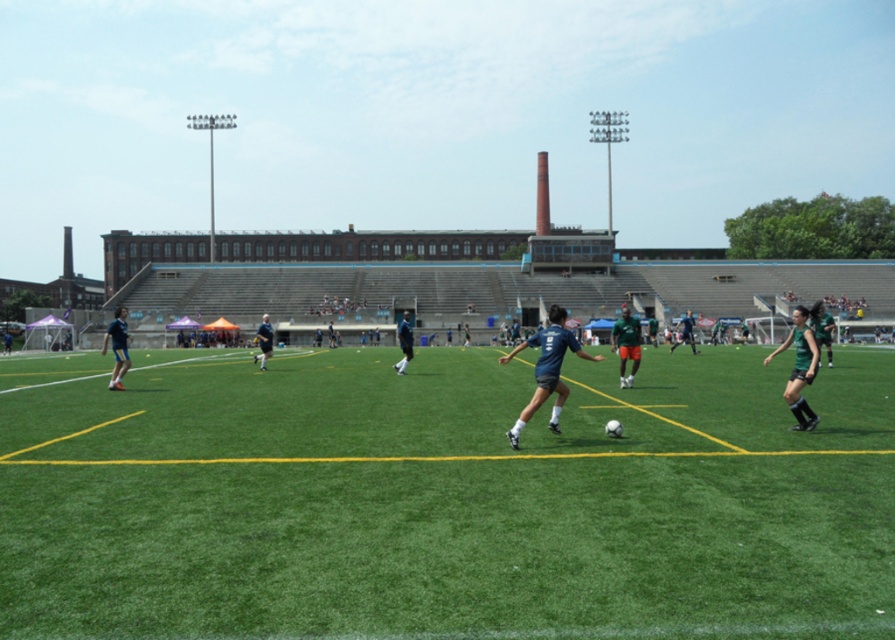
You are a soccer coach observing the field. You notice the green artificial turf at center and the green matte shorts at right. Which object takes up more space in the image?

The green matte shorts at right takes up more space in the image because it is larger than the green artificial turf at center.

You are a soccer player standing at the edge of the field. You need to run to the green artificial turf at center. Which direction should you head towards?

The green artificial turf at center is located at point [444,499], so you should head towards the center of the field to reach it.